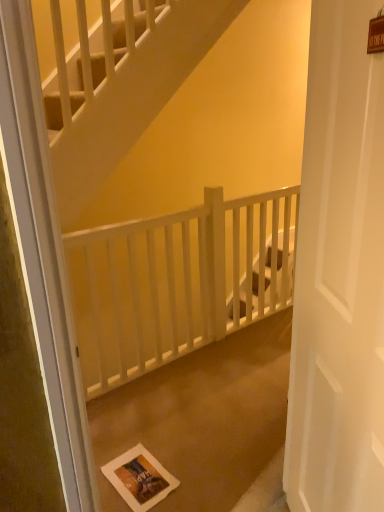
Question: In terms of size, does white matte door at center appear bigger or smaller than white paper postcard at lower center?

Choices:
 (A) small
 (B) big

Answer: (B)

Question: In terms of width, does white matte door at center look wider or thinner when compared to white paper postcard at lower center?

Choices:
 (A) wide
 (B) thin

Answer: (B)

Question: Based on their relative distances, which object is nearer to the white wooden balustrade at center?

Choices:
 (A) white matte door at center
 (B) white paper bag at center
 (C) white paper postcard at lower center

Answer: (B)

Question: Which of these objects is positioned farthest from the white wooden balustrade at center?

Choices:
 (A) white paper postcard at lower center
 (B) white paper bag at center
 (C) white matte door at center

Answer: (C)